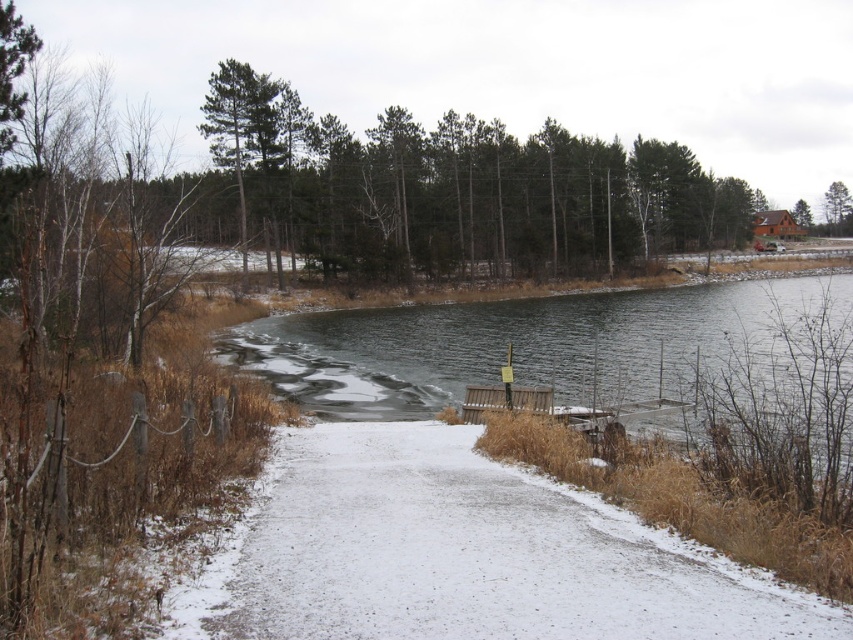
You are standing at the point marked by the coordinates point (474, 554) in the image. What is the closest object to you?

The closest object to you is the white snow covered path at center, as the coordinates point (474, 554) indicates that location.